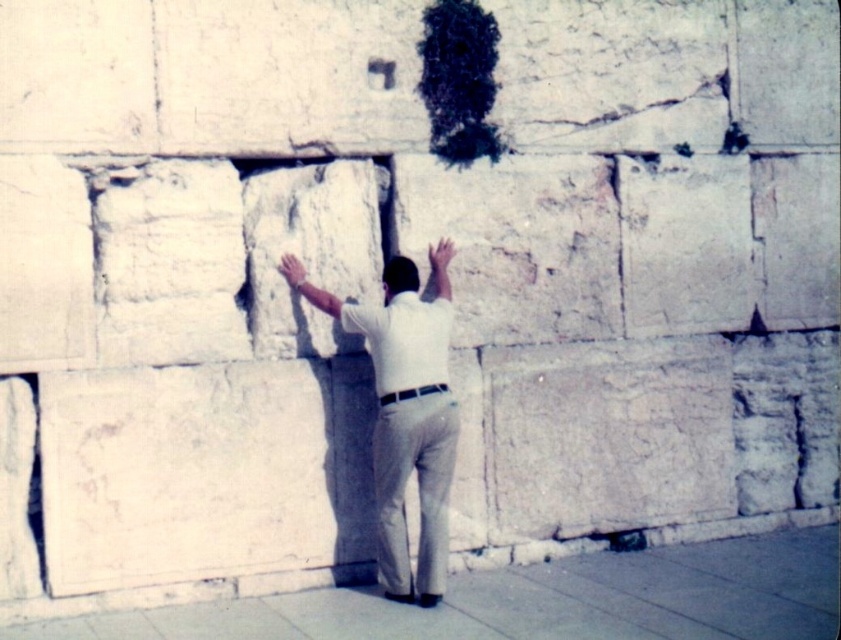
Based on the photo, you are an observer looking at the scene. There is a white stone man at center and a white cotton shirt at center. Which object is positioned lower in the image?

The white stone man at center is located below the white cotton shirt at center, so the white stone man at center is positioned lower in the image.

You are an artist planning to sketch the scene. You need to decide which object, the white stone man at center or the white cotton shirt at center, requires more attention to detail due to its larger size. Which one should you focus on?

The white stone man at center has a greater width than the white cotton shirt at center, so you should focus more on detailing the white stone man at center.

You are a photographer trying to capture the white stone man at center and the white cotton shirt at center in a single frame. Based on their sizes, which one should you focus on to ensure both are visible clearly?

The white stone man at center is bigger than the white cotton shirt at center, so you should focus on the white stone man at center to ensure both are visible clearly.